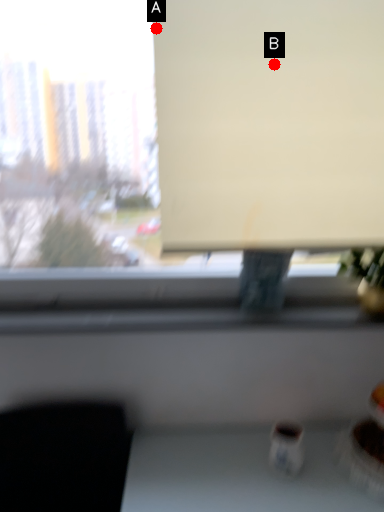
Question: Two points are circled on the image, labeled by A and B beside each circle. Which point appears closest to the camera in this image?

Choices:
 (A) A is closer
 (B) B is closer

Answer: (A)